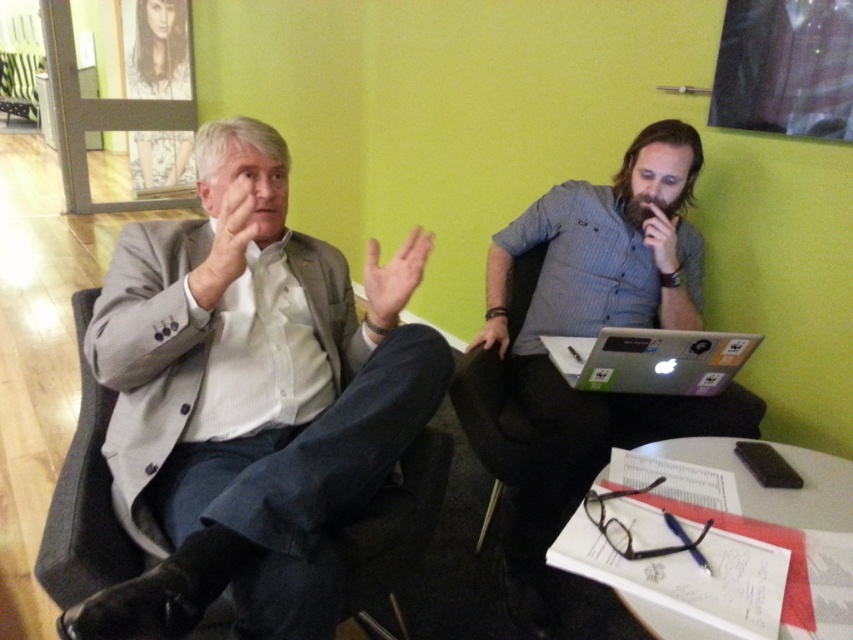
What are the coordinates of the light gray suit at left in the image?

The light gray suit at left is located at coordinates point (248,401).

Consider the image. You are a photographer setting up for a group photo. You need to ensure that both the light gray suit at left and the silver metallic laptop at center right are clearly visible in the frame. Based on their positions, which object is closer to the camera?

The light gray suit at left is closer to the camera because it is in front of the silver metallic laptop at center right.